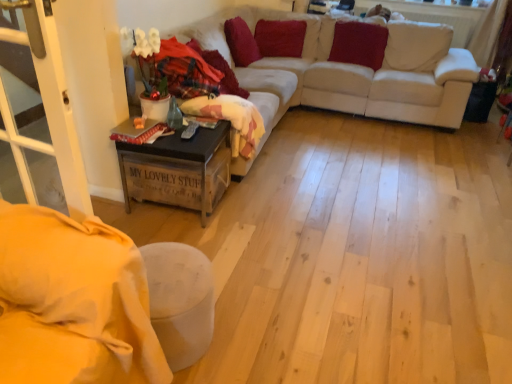
In order to click on free space in front of wooden crate at lower left in this screenshot , I will do `click(168, 232)`.